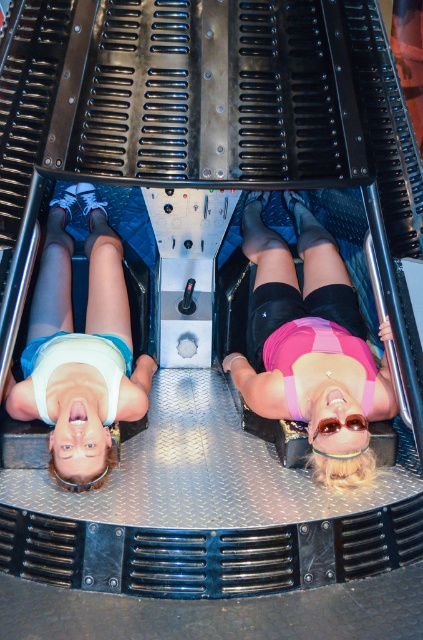
Question: Can you confirm if pink matte fabric at center is positioned to the left of white matte tank top at upper center?

Choices:
 (A) yes
 (B) no

Answer: (B)

Question: Among these objects, which one is farthest from the camera?

Choices:
 (A) pink matte fabric at center
 (B) white matte tank top at upper center

Answer: (A)

Question: Does pink matte fabric at center have a larger size compared to white matte tank top at upper center?

Choices:
 (A) yes
 (B) no

Answer: (A)

Question: Can you confirm if pink matte fabric at center is positioned to the left of white matte tank top at upper center?

Choices:
 (A) yes
 (B) no

Answer: (B)

Question: Which point appears farthest from the camera in this image?

Choices:
 (A) (49, 284)
 (B) (294, 304)

Answer: (A)